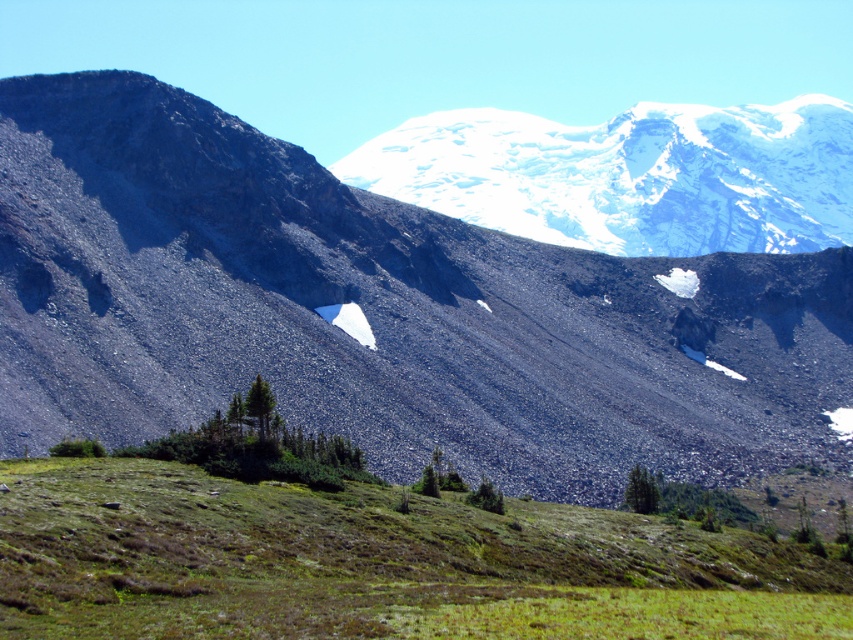
Question: Which point is closer to the camera?

Choices:
 (A) green grassy field at lower center
 (B) white snow-covered mountain at upper center
 (C) rocky gray mountain range at upper center

Answer: (A)

Question: Which object appears closest to the camera in this image?

Choices:
 (A) white snow-covered mountain at upper center
 (B) green grassy field at lower center

Answer: (B)

Question: Can you confirm if green grassy field at lower center is positioned above white snow-covered mountain at upper center?

Choices:
 (A) no
 (B) yes

Answer: (A)

Question: Is rocky gray mountain range at upper center closer to the viewer compared to green grassy field at lower center?

Choices:
 (A) yes
 (B) no

Answer: (B)

Question: Which object appears farthest from the camera in this image?

Choices:
 (A) green grassy field at lower center
 (B) white snow-covered mountain at upper center
 (C) rocky gray mountain range at upper center

Answer: (B)

Question: Can you confirm if green grassy field at lower center is positioned above white snow-covered mountain at upper center?

Choices:
 (A) yes
 (B) no

Answer: (B)